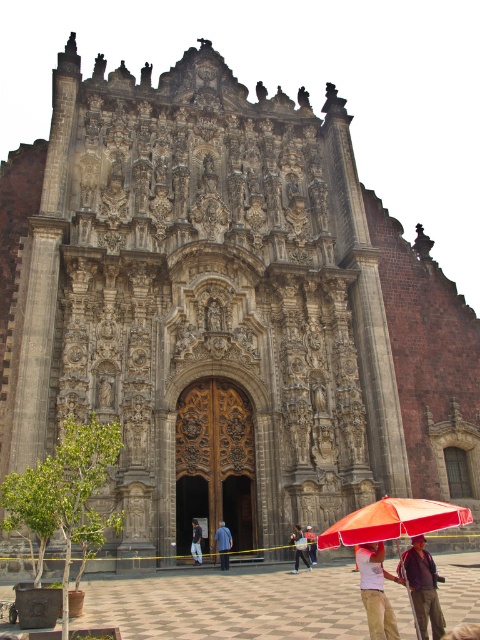
Which is above, blue fabric shirt at center or dark blue jeans at center?

blue fabric shirt at center

Between blue fabric shirt at center and dark blue jeans at center, which one appears on the left side from the viewer's perspective?

Positioned to the left is dark blue jeans at center.

Does point (225, 561) lie behind point (197, 557)?

No, it is in front of (197, 557).

You are a GUI agent. You are given a task and a screenshot of the screen. Output one action in this format:
    pyautogui.click(x=<x>, y=<y>)
    Task: Click on the blue fabric shirt at center
    This screenshot has height=640, width=480.
    Given the screenshot: What is the action you would take?
    pyautogui.click(x=224, y=544)

Which is more to the left, orange fabric umbrella at lower center or light blue shirt at center?

light blue shirt at center is more to the left.

Is orange fabric umbrella at lower center positioned at the back of light blue shirt at center?

No, it is not.

Between point (434, 528) and point (305, 564), which one is positioned behind?

The point (305, 564) is more distant.

This screenshot has height=640, width=480. I want to click on orange fabric umbrella at lower center, so click(x=393, y=520).

Who is lower down, light blue shirt at center or light blue denim jeans at center?

light blue denim jeans at center

Between point (298, 556) and point (312, 561), which one is positioned in front?

Point (298, 556) is in front.

This screenshot has width=480, height=640. Find the location of `light blue shirt at center`. light blue shirt at center is located at coordinates (300, 548).